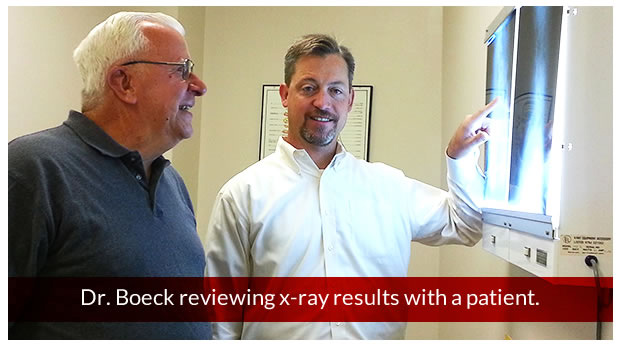
Image resolution: width=621 pixels, height=346 pixels. Identify the location of wall. (451, 73).